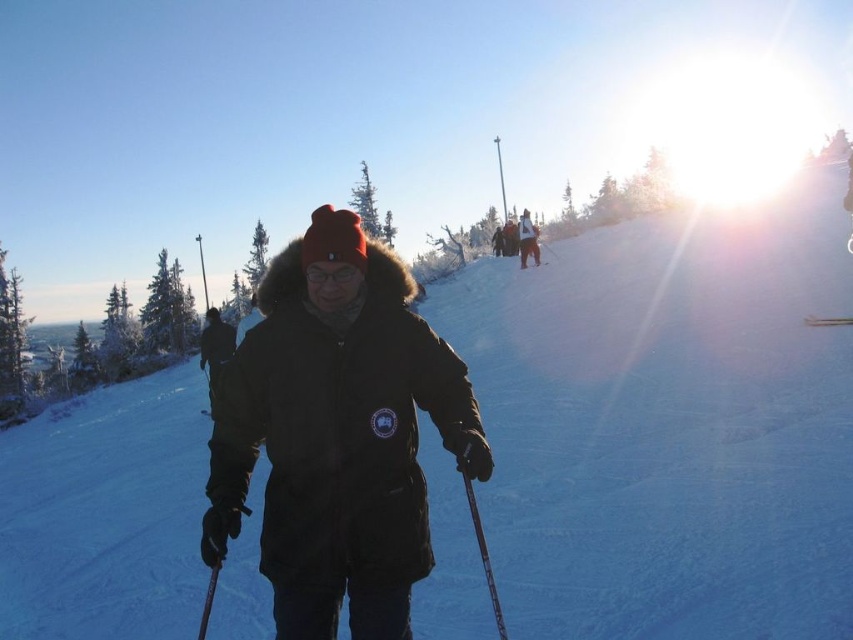
Does black matte jacket at center have a larger size compared to white snowboard at upper center?

Incorrect, black matte jacket at center is not larger than white snowboard at upper center.

Who is higher up, black matte jacket at center or white snowboard at upper center?

Positioned higher is white snowboard at upper center.

You are a GUI agent. You are given a task and a screenshot of the screen. Output one action in this format:
    pyautogui.click(x=<x>, y=<y>)
    Task: Click on the black matte jacket at center
    The height and width of the screenshot is (640, 853).
    Given the screenshot: What is the action you would take?
    pyautogui.click(x=337, y=433)

You are a GUI agent. You are given a task and a screenshot of the screen. Output one action in this format:
    pyautogui.click(x=<x>, y=<y>)
    Task: Click on the black matte jacket at center
    
    Given the screenshot: What is the action you would take?
    pyautogui.click(x=337, y=433)

Who is positioned more to the left, white snowboard at upper center or matte black ski at upper center?

Positioned to the left is matte black ski at upper center.

Does point (529, 225) come closer to viewer compared to point (524, 260)?

No, it is behind (524, 260).

Is point (531, 232) positioned behind point (538, 262)?

That is True.

This screenshot has width=853, height=640. In order to click on white snowboard at upper center in this screenshot , I will do `click(527, 240)`.

Which is below, white snowboard at upper center or metallic silver ski at center?

metallic silver ski at center is below.

Which of these two, white snowboard at upper center or metallic silver ski at center, stands taller?

Standing taller between the two is white snowboard at upper center.

What do you see at coordinates (527, 240) in the screenshot? This screenshot has width=853, height=640. I see `white snowboard at upper center` at bounding box center [527, 240].

The height and width of the screenshot is (640, 853). Identify the location of white snowboard at upper center. (527, 240).